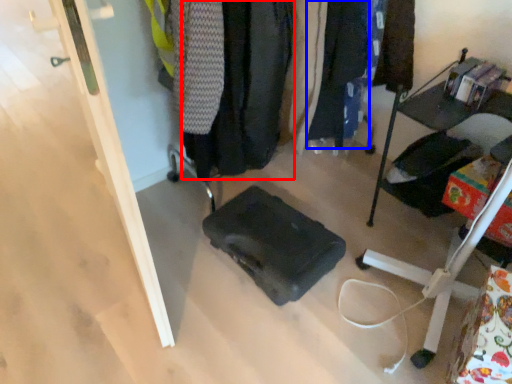
Question: Which object appears farthest to the camera in this image, clothing (highlighted by a red box) or clothing (highlighted by a blue box)?

Choices:
 (A) clothing
 (B) clothing

Answer: (B)